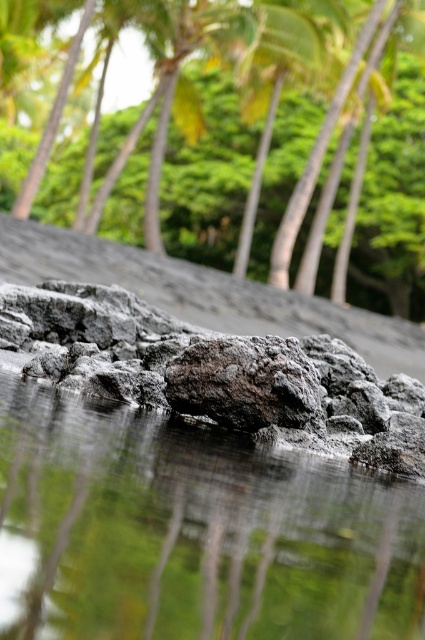
The width and height of the screenshot is (425, 640). Identify the location of reflective wet rock at center. (192, 531).

Who is shorter, reflective wet rock at center or rough gray rock at center?

reflective wet rock at center is shorter.

Who is more forward, (2, 385) or (240, 385)?

Point (2, 385) is in front.

Image resolution: width=425 pixels, height=640 pixels. Identify the location of reflective wet rock at center. (192, 531).

Does reflective wet rock at center have a lesser width compared to green leafy palm tree at upper center?

Yes.

From the picture: Is reflective wet rock at center to the right of green leafy palm tree at upper center from the viewer's perspective?

Incorrect, reflective wet rock at center is not on the right side of green leafy palm tree at upper center.

You are a GUI agent. You are given a task and a screenshot of the screen. Output one action in this format:
    pyautogui.click(x=<x>, y=<y>)
    Task: Click on the reflective wet rock at center
    This screenshot has height=640, width=425.
    Given the screenshot: What is the action you would take?
    pyautogui.click(x=192, y=531)

Which of these two, rough gray rock at center or green leafy palm tree at upper center, stands shorter?

With less height is rough gray rock at center.

Is rough gray rock at center positioned at the back of green leafy palm tree at upper center?

No, it is not.

Find the location of a particular element. rough gray rock at center is located at coordinates (246, 381).

Where is `rough gray rock at center`? This screenshot has width=425, height=640. rough gray rock at center is located at coordinates (246, 381).